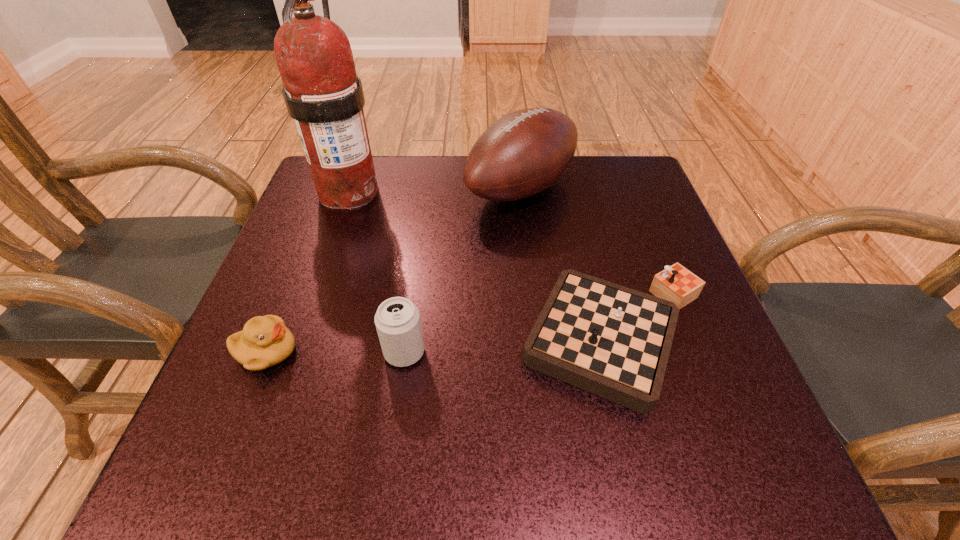
This screenshot has width=960, height=540. In order to click on the tallest object in this screenshot , I will do `click(322, 93)`.

You are a GUI agent. You are given a task and a screenshot of the screen. Output one action in this format:
    pyautogui.click(x=<x>, y=<y>)
    Task: Click on the fourth shortest object
    This screenshot has width=960, height=540.
    Given the screenshot: What is the action you would take?
    pyautogui.click(x=524, y=152)

The image size is (960, 540). I want to click on can, so click(397, 320).

Find the location of a particular element. the third shortest object is located at coordinates (397, 320).

I want to click on duckling, so click(x=265, y=341).

The height and width of the screenshot is (540, 960). I want to click on the shortest object, so click(613, 341).

This screenshot has height=540, width=960. Find the location of `vacant area situated at the nozzle of the tallest object`. vacant area situated at the nozzle of the tallest object is located at coordinates (328, 250).

Identify the location of blank space located 0.100m on the right of the football (American). This screenshot has width=960, height=540. (616, 188).

Locate an element on the screen. The height and width of the screenshot is (540, 960). free spot located 0.140m on the back of the can is located at coordinates (415, 279).

Image resolution: width=960 pixels, height=540 pixels. In order to click on vacant space located 0.300m at the beak of the fourth tallest object in this screenshot , I will do [x=470, y=352].